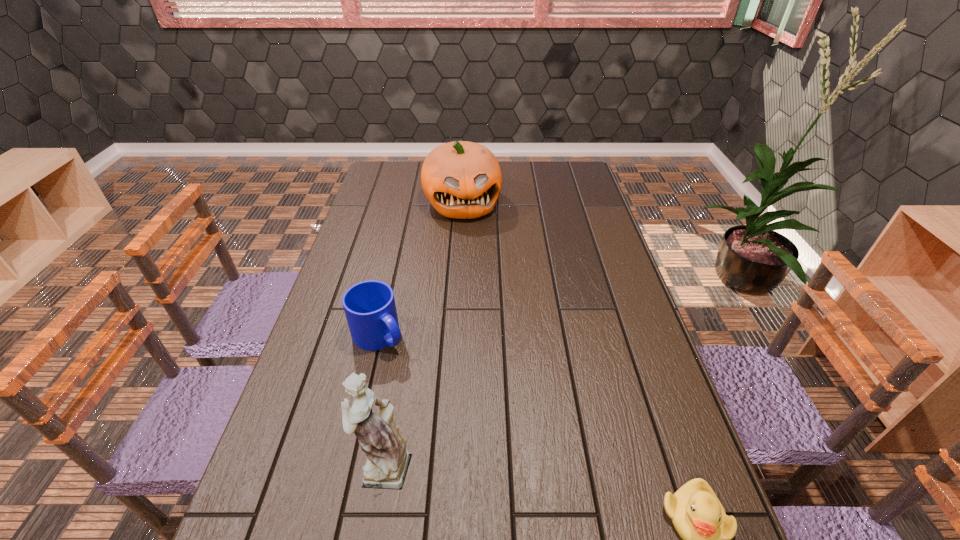
The image size is (960, 540). Identify the location of the tallest object. (387, 463).

I want to click on the second farthest object, so pos(369,306).

Where is `the third tallest object`? the third tallest object is located at coordinates (369, 306).

Find the location of a particular element. the farthest object is located at coordinates (462, 180).

The height and width of the screenshot is (540, 960). Identify the location of pumpkin. click(x=462, y=180).

Locate an element on the screen. This screenshot has width=960, height=540. vacant space located 0.110m on the front-facing side of the figurine is located at coordinates (301, 464).

At what (x,y) coordinates should I click in order to perform the action: click on vacant area located on the front-facing side of the figurine. Please return your answer as a coordinate pair (x, y). Looking at the image, I should click on (277, 464).

The image size is (960, 540). In order to click on vacant space positioned on the front-facing side of the figurine in this screenshot , I will do `click(306, 464)`.

Find the location of a particular element. The width and height of the screenshot is (960, 540). free space located 0.060m on the side with the handle of the mug is located at coordinates (410, 366).

Where is `free space located on the side with the handle of the mug`? This screenshot has height=540, width=960. free space located on the side with the handle of the mug is located at coordinates (456, 410).